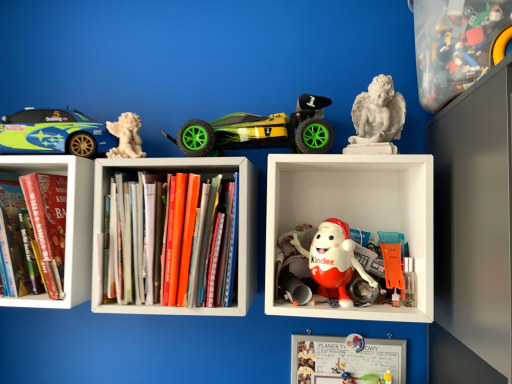
Question: Is hardcover book at left, placed as the 1th book when sorted from left to right, to the left or to the right of translucent plastic container at upper right, which ranks as the 5th toy in left-to-right order, in the image?

Choices:
 (A) left
 (B) right

Answer: (A)

Question: In terms of height, does hardcover book at left, placed as the 1th book when sorted from left to right, look taller or shorter compared to translucent plastic container at upper right, which is the 1th toy in right-to-left order?

Choices:
 (A) tall
 (B) short

Answer: (B)

Question: Which is farther from the matte plastic kinder egg at center, which is the third toy from right to left?

Choices:
 (A) whiteboard at center
 (B) hardcover book at left, which is counted as the 2th book, starting from the right
 (C) translucent plastic container at upper right, which is the 1th toy in right-to-left order
 (D) white marble angel at upper left, which ranks as the 1th toy in left-to-right order
 (E) white marble statue at upper right, placed as the 2th toy when sorted from right to left

Answer: (B)

Question: Considering the real-world distances, which object is farthest from the whiteboard at center?

Choices:
 (A) translucent plastic container at upper right, which is the 1th toy in right-to-left order
 (B) green matte toy car at center, which is counted as the 2th toy, starting from the left
 (C) matte plastic kinder egg at center, which is the third toy from right to left
 (D) white plastic kinder egg at center
 (E) white marble statue at upper right, placed as the 2th toy when sorted from right to left

Answer: (A)